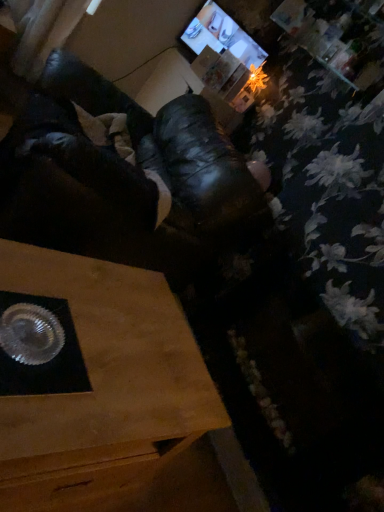
Question: Can we say shiny metallic tray at lower left lies outside wooden table at lower left?

Choices:
 (A) yes
 (B) no

Answer: (A)

Question: Considering the relative sizes of shiny metallic tray at lower left and wooden table at lower left in the image provided, is shiny metallic tray at lower left bigger than wooden table at lower left?

Choices:
 (A) no
 (B) yes

Answer: (B)

Question: From the image's perspective, is shiny metallic tray at lower left over wooden table at lower left?

Choices:
 (A) yes
 (B) no

Answer: (A)

Question: Can you confirm if shiny metallic tray at lower left is shorter than wooden table at lower left?

Choices:
 (A) yes
 (B) no

Answer: (B)

Question: Considering the relative sizes of shiny metallic tray at lower left and wooden table at lower left in the image provided, is shiny metallic tray at lower left thinner than wooden table at lower left?

Choices:
 (A) yes
 (B) no

Answer: (B)

Question: Is shiny metallic tray at lower left at the left side of wooden table at lower left?

Choices:
 (A) yes
 (B) no

Answer: (B)

Question: From a real-world perspective, is wooden table at lower left under shiny metallic tray at lower left?

Choices:
 (A) no
 (B) yes

Answer: (B)

Question: Is wooden table at lower left taller than shiny metallic tray at lower left?

Choices:
 (A) no
 (B) yes

Answer: (A)

Question: Is wooden table at lower left oriented away from shiny metallic tray at lower left?

Choices:
 (A) no
 (B) yes

Answer: (A)

Question: Does wooden table at lower left have a lesser height compared to shiny metallic tray at lower left?

Choices:
 (A) no
 (B) yes

Answer: (B)

Question: Is there a large distance between wooden table at lower left and shiny metallic tray at lower left?

Choices:
 (A) no
 (B) yes

Answer: (A)

Question: From the image's perspective, is wooden table at lower left on top of shiny metallic tray at lower left?

Choices:
 (A) no
 (B) yes

Answer: (A)

Question: Is wooden table at lower left touching matte black monitor at upper center?

Choices:
 (A) yes
 (B) no

Answer: (B)